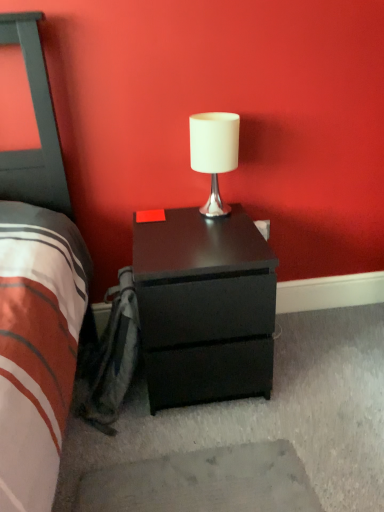
Find the location of `free space in front of white matte table lamp at center`. free space in front of white matte table lamp at center is located at coordinates (211, 234).